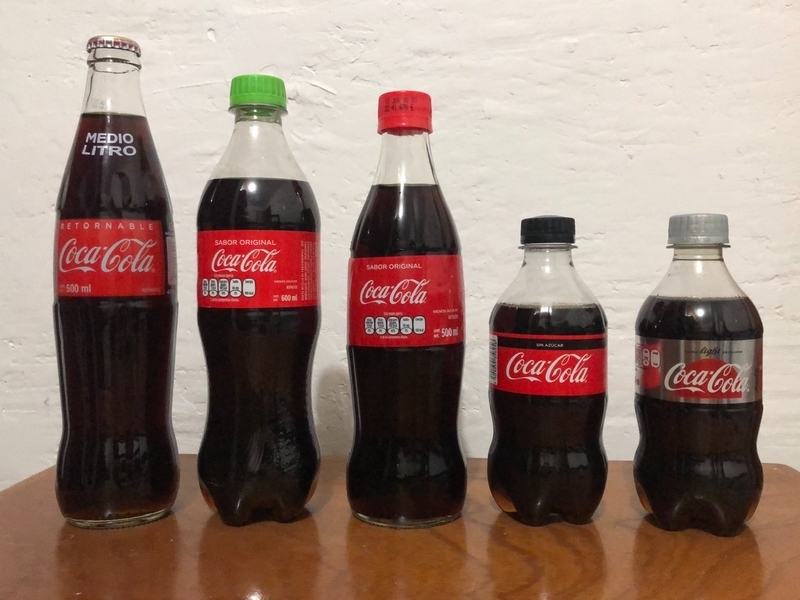
The height and width of the screenshot is (600, 800). In order to click on bottles in this screenshot , I will do `click(262, 250)`, `click(369, 252)`, `click(536, 327)`, `click(698, 372)`.